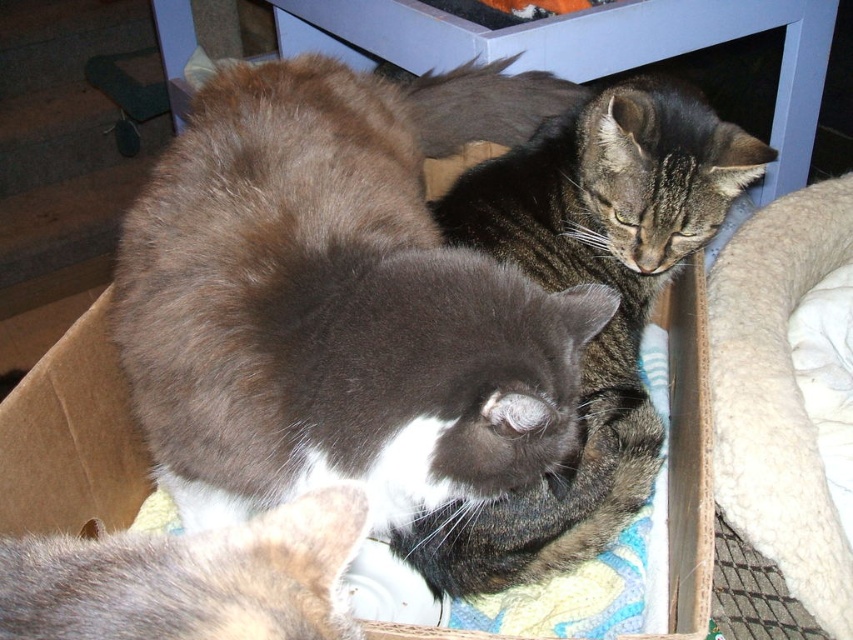
Which is below, gray fur cat at center or gray soft fur at lower left?

gray soft fur at lower left

Which is behind, point (467, 102) or point (341, 545)?

The point (467, 102) is behind.

The height and width of the screenshot is (640, 853). What are the coordinates of `gray fur cat at center` in the screenshot? It's located at (340, 298).

Is gray fur cat at center bigger than tabby fur cat at center?

Yes, gray fur cat at center is bigger than tabby fur cat at center.

How far apart are gray fur cat at center and tabby fur cat at center?

gray fur cat at center and tabby fur cat at center are 8.63 inches apart.

Between point (297, 276) and point (556, 240), which one is positioned in front?

Positioned in front is point (297, 276).

Where is `gray fur cat at center`? The width and height of the screenshot is (853, 640). gray fur cat at center is located at coordinates (340, 298).

Between tabby fur cat at center and gray soft fur at lower left, which one appears on the right side from the viewer's perspective?

Positioned to the right is tabby fur cat at center.

Which is above, tabby fur cat at center or gray soft fur at lower left?

tabby fur cat at center is above.

Is point (704, 141) farther from camera compared to point (335, 620)?

Yes, point (704, 141) is farther from viewer.

I want to click on tabby fur cat at center, so click(583, 282).